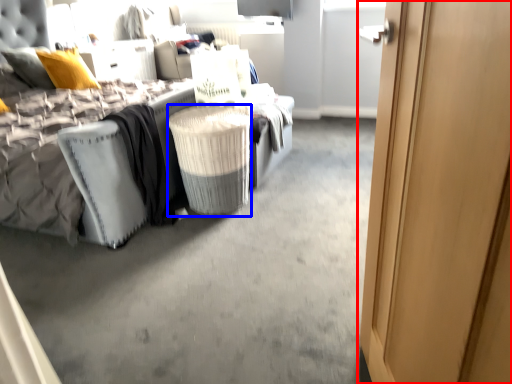
Question: Which of the following is the closest to the observer, door (highlighted by a red box) or laundry basket (highlighted by a blue box)?

Choices:
 (A) door
 (B) laundry basket

Answer: (A)